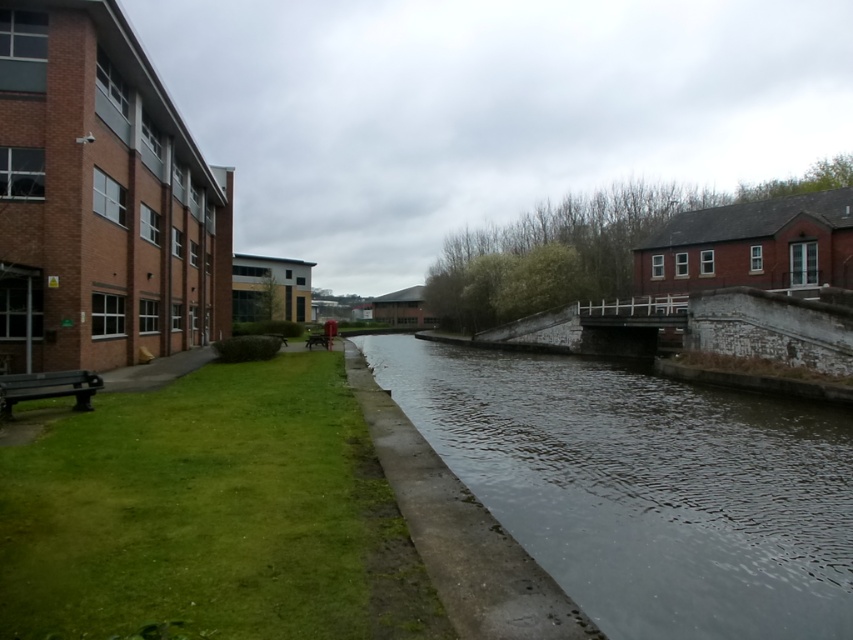
Question: Which of the following is the closest to the observer?

Choices:
 (A) 48,589
 (B) 752,461

Answer: (A)

Question: Where is green grass at lower left located in relation to clear water at center in the image?

Choices:
 (A) above
 (B) below

Answer: (A)

Question: Does green grass at lower left come behind clear water at center?

Choices:
 (A) yes
 (B) no

Answer: (B)

Question: Which point is farther to the camera?

Choices:
 (A) green grass at lower left
 (B) clear water at center

Answer: (B)

Question: Is green grass at lower left to the left of clear water at center from the viewer's perspective?

Choices:
 (A) no
 (B) yes

Answer: (B)

Question: Which object appears closest to the camera in this image?

Choices:
 (A) clear water at center
 (B) green grass at lower left

Answer: (B)